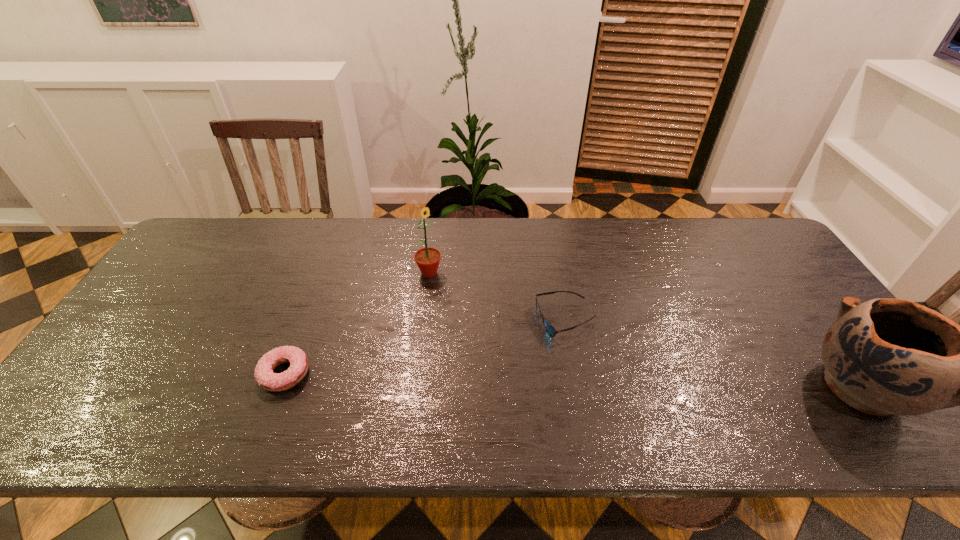
Locate an element on the screen. This screenshot has height=540, width=960. free space located at the front of the second object from right to left showing the lenses is located at coordinates (536, 355).

Where is `vacant position located on the face of the sunflower`? This screenshot has height=540, width=960. vacant position located on the face of the sunflower is located at coordinates (499, 340).

This screenshot has height=540, width=960. In order to click on vacant space located on the face of the sunflower in this screenshot , I will do `click(458, 300)`.

Where is `vacant space located on the face of the sunflower`? The height and width of the screenshot is (540, 960). vacant space located on the face of the sunflower is located at coordinates (502, 342).

This screenshot has width=960, height=540. What are the coordinates of `object located at the far edge` in the screenshot? It's located at (427, 259).

Identify the location of doughnut that is at the near edge. (267, 379).

Locate an element on the screen. This screenshot has width=960, height=540. pottery that is at the near edge is located at coordinates (886, 356).

Where is `object situated at the right edge`? This screenshot has height=540, width=960. object situated at the right edge is located at coordinates (886, 356).

Where is `object situated at the near right corner`? The image size is (960, 540). object situated at the near right corner is located at coordinates (886, 356).

The height and width of the screenshot is (540, 960). Find the location of `vacant point at the far edge`. vacant point at the far edge is located at coordinates (370, 221).